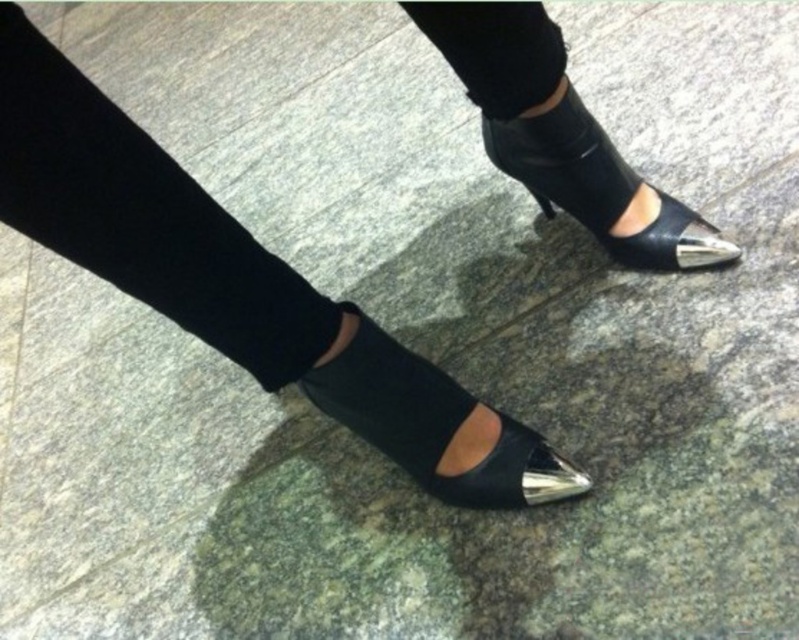
Question: Does black suede ankle boots at lower center appear on the left side of matte black sandal at lower center?

Choices:
 (A) yes
 (B) no

Answer: (A)

Question: Which point is farther to the camera?

Choices:
 (A) black suede ankle boots at lower center
 (B) metallic leather sandal at center
 (C) black leather shoes at center
 (D) matte black sandal at lower center

Answer: (B)

Question: Estimate the real-world distances between objects in this image. Which object is closer to the black leather shoes at center?

Choices:
 (A) matte black sandal at lower center
 (B) black suede ankle boots at lower center
 (C) metallic leather sandal at center

Answer: (B)

Question: Is matte black sandal at lower center to the left of metallic leather sandal at center from the viewer's perspective?

Choices:
 (A) yes
 (B) no

Answer: (A)

Question: Which is nearer to the matte black sandal at lower center?

Choices:
 (A) black suede ankle boots at lower center
 (B) metallic leather sandal at center

Answer: (A)

Question: Is black suede ankle boots at lower center positioned before matte black sandal at lower center?

Choices:
 (A) no
 (B) yes

Answer: (B)